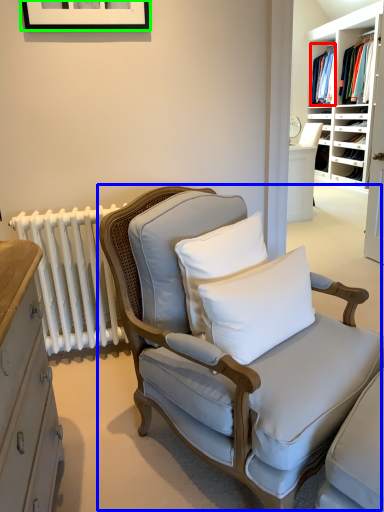
Question: Estimate the real-world distances between objects in this image. Which object is closer to clothing (highlighted by a red box), chair (highlighted by a blue box) or picture frame (highlighted by a green box)?

Choices:
 (A) chair
 (B) picture frame

Answer: (B)